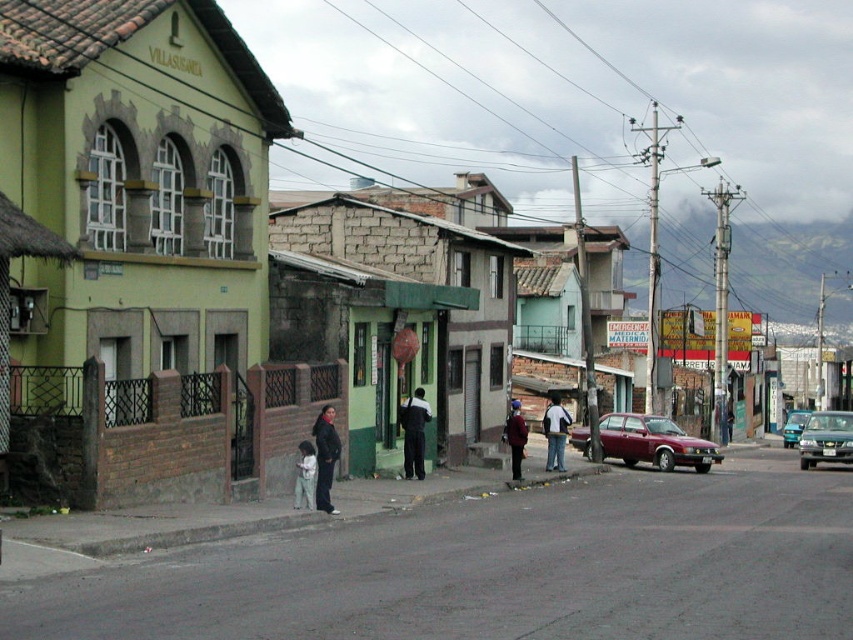
You are standing on the sidewalk and want to cross the street to reach the building with the sign VILLASUSANZA. The maroon metallic sedan at center is blocking your path. Can you safely walk around it to get to the building?

The maroon metallic sedan at center is 38.61 meters away from you, so you can safely walk around it to reach the building with the sign VILLASUSANZA.

You are a delivery person standing at point (x=293, y=493) and need to deliver a package to point (x=422, y=416). Which direction should you move to reach the destination?

You should move backward to reach point (x=422, y=416) because it is behind point (x=293, y=493).

You are a delivery driver who needs to park your vehicle in a space that is exactly 5 meters long. You have two options in the image, a metallic silver sedan at center and a metallic silver van at center. Which vehicle would fit better in the parking space?

The metallic silver sedan at center is shorter than the metallic silver van at center, so the sedan would fit better in the 5 meter parking space since it is shorter than the van.